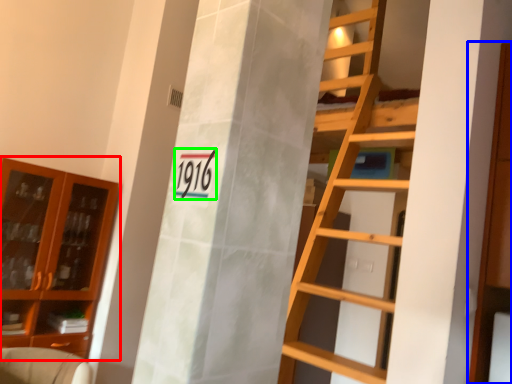
Question: Based on their relative distances, which object is nearer to cabinetry (highlighted by a red box)? Choose from cabinetry (highlighted by a blue box) and number (highlighted by a green box).

Choices:
 (A) cabinetry
 (B) number

Answer: (A)